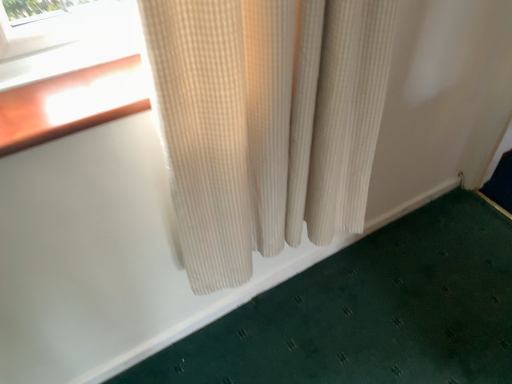
Identify the location of green textured bath mat at lower right. (370, 312).

The height and width of the screenshot is (384, 512). What do you see at coordinates (370, 312) in the screenshot? I see `green textured bath mat at lower right` at bounding box center [370, 312].

Identify the location of beige corduroy curtain at center. The height and width of the screenshot is (384, 512). (266, 122).

What do you see at coordinates (266, 122) in the screenshot? This screenshot has width=512, height=384. I see `beige corduroy curtain at center` at bounding box center [266, 122].

Locate an element on the screen. green textured bath mat at lower right is located at coordinates (370, 312).

Can you confirm if beige corduroy curtain at center is positioned to the left of green textured bath mat at lower right?

Correct, you'll find beige corduroy curtain at center to the left of green textured bath mat at lower right.

Which object is closer to the camera, beige corduroy curtain at center or green textured bath mat at lower right?

beige corduroy curtain at center is closer to the camera.

Which is closer, (189, 191) or (425, 263)?

Point (189, 191) is positioned closer to the camera compared to point (425, 263).

From the image's perspective, is beige corduroy curtain at center above green textured bath mat at lower right?

Yes.

From a real-world perspective, does beige corduroy curtain at center sit lower than green textured bath mat at lower right?

No, from a real-world perspective, beige corduroy curtain at center is not beneath green textured bath mat at lower right.

Between beige corduroy curtain at center and green textured bath mat at lower right, which one has larger width?

beige corduroy curtain at center.

Does beige corduroy curtain at center have a lesser height compared to green textured bath mat at lower right?

No, beige corduroy curtain at center is not shorter than green textured bath mat at lower right.

Consider the image. Between beige corduroy curtain at center and green textured bath mat at lower right, which one has larger size?

Bigger between the two is beige corduroy curtain at center.

Is green textured bath mat at lower right inside beige corduroy curtain at center?

No, green textured bath mat at lower right is not surrounded by beige corduroy curtain at center.

Is beige corduroy curtain at center touching green textured bath mat at lower right?

beige corduroy curtain at center and green textured bath mat at lower right are not in contact.

Is beige corduroy curtain at center facing towards green textured bath mat at lower right?

No, beige corduroy curtain at center is not turned towards green textured bath mat at lower right.

Where is `bath mat that appears on the right of beige corduroy curtain at center`? bath mat that appears on the right of beige corduroy curtain at center is located at coordinates (370, 312).

Considering the relative positions of green textured bath mat at lower right and beige corduroy curtain at center in the image provided, is green textured bath mat at lower right to the left of beige corduroy curtain at center from the viewer's perspective?

No, green textured bath mat at lower right is not to the left of beige corduroy curtain at center.

Which object is further away from the camera, green textured bath mat at lower right or beige corduroy curtain at center?

green textured bath mat at lower right.

Is point (476, 276) positioned in front of point (198, 2)?

No, it is not.

From the image's perspective, does green textured bath mat at lower right appear lower than beige corduroy curtain at center?

Indeed, from the image's perspective, green textured bath mat at lower right is shown beneath beige corduroy curtain at center.

From the picture: From a real-world perspective, does green textured bath mat at lower right stand above beige corduroy curtain at center?

Incorrect, from a real-world perspective, green textured bath mat at lower right is lower than beige corduroy curtain at center.

Considering the sizes of objects green textured bath mat at lower right and beige corduroy curtain at center in the image provided, who is wider, green textured bath mat at lower right or beige corduroy curtain at center?

With larger width is beige corduroy curtain at center.

Which of these two, green textured bath mat at lower right or beige corduroy curtain at center, stands taller?

With more height is beige corduroy curtain at center.

Is green textured bath mat at lower right smaller than beige corduroy curtain at center?

Yes.

Consider the image. Could beige corduroy curtain at center be considered to be inside green textured bath mat at lower right?

No, beige corduroy curtain at center is not inside green textured bath mat at lower right.

Are green textured bath mat at lower right and beige corduroy curtain at center making contact?

They are not placed beside each other.

Does green textured bath mat at lower right turn towards beige corduroy curtain at center?

No, green textured bath mat at lower right is not oriented towards beige corduroy curtain at center.

Measure the distance between green textured bath mat at lower right and beige corduroy curtain at center.

Result: 25.52 inches.

Where is `bath mat behind the beige corduroy curtain at center`? bath mat behind the beige corduroy curtain at center is located at coordinates (370, 312).

Find the location of `curtain that appears in front of the green textured bath mat at lower right`. curtain that appears in front of the green textured bath mat at lower right is located at coordinates pyautogui.click(x=266, y=122).

Find the location of a particular element. The width and height of the screenshot is (512, 384). bath mat below the beige corduroy curtain at center (from a real-world perspective) is located at coordinates (370, 312).